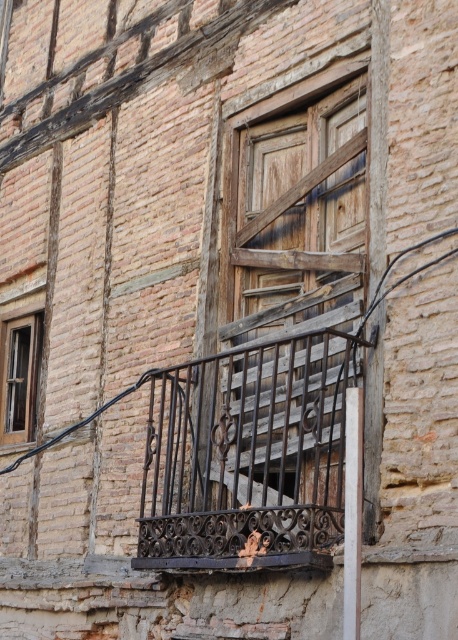
You are standing in front of the aged brick building. You notice the rusty wrought iron balustrade at center and the wooden window at left. Which object is closer to you from your current position?

The rusty wrought iron balustrade at center is closer to you because it is in front of the wooden window at left.

You are standing in front of the aged brick building. Where is the rusty wrought iron balustrade at center located in terms of coordinates?

The rusty wrought iron balustrade at center is located at point coordinates of (247, 456).

You are a painter hired to paint the rusty wrought iron balustrade at center and the wooden window at left. You have a ladder that can extend up to 1.5 meters. The distance between the balustrade and the window is 1.2 meters. Can you safely reach both objects with your ladder without moving it?

The distance between the rusty wrought iron balustrade at center and the wooden window at left is 1.2 meters. Since the ladder can extend up to 1.5 meters, you can safely reach both objects without moving the ladder as the distance is within the ladder capacity.